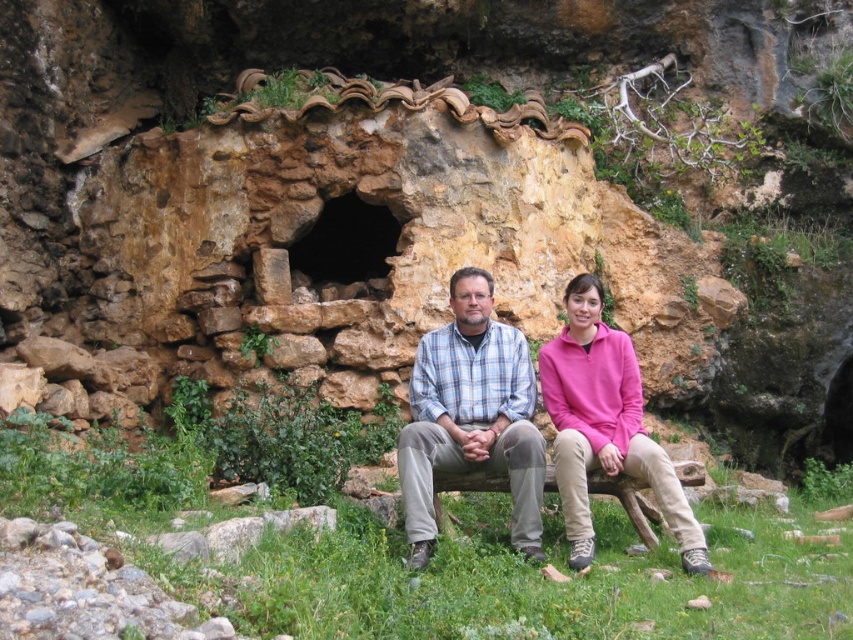
Question: Does brown stone cave at center have a larger size compared to brown wooden bench at center?

Choices:
 (A) yes
 (B) no

Answer: (B)

Question: Which object is farther from the camera taking this photo?

Choices:
 (A) brown stone cave at center
 (B) brown wooden bench at center

Answer: (A)

Question: Among these points, which one is nearest to the camera?

Choices:
 (A) (604, 474)
 (B) (641, 420)

Answer: (A)

Question: Observing the image, what is the correct spatial positioning of brown stone cave at center in reference to brown wooden bench at center?

Choices:
 (A) above
 (B) below

Answer: (A)

Question: Which point is farther to the camera?

Choices:
 (A) brown wooden bench at center
 (B) plaid fabric shirt at center
 (C) brown stone cave at center

Answer: (C)

Question: Is brown stone cave at center in front of brown wooden bench at center?

Choices:
 (A) yes
 (B) no

Answer: (B)